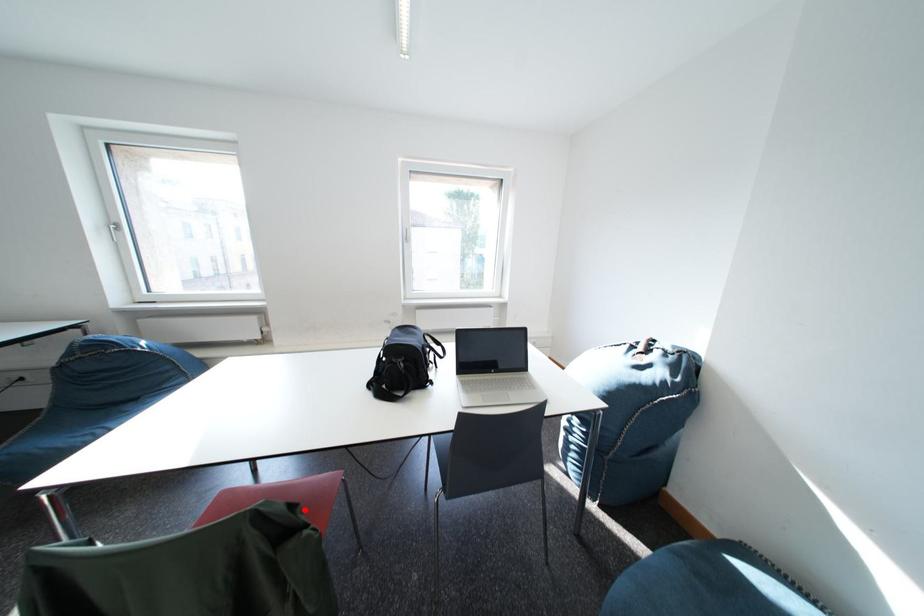
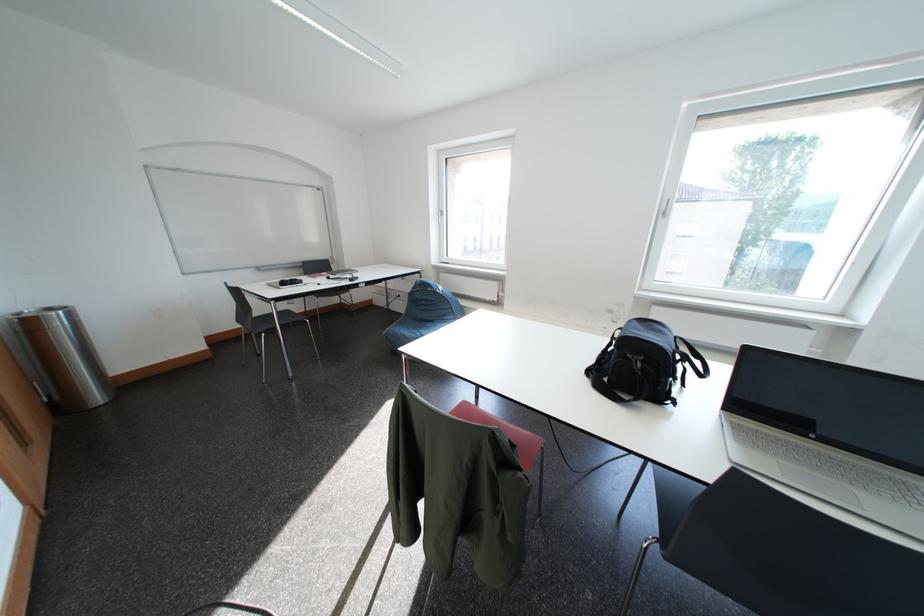
Find the pixel in the second image that matches the highlighted location in the first image.

(525, 450)